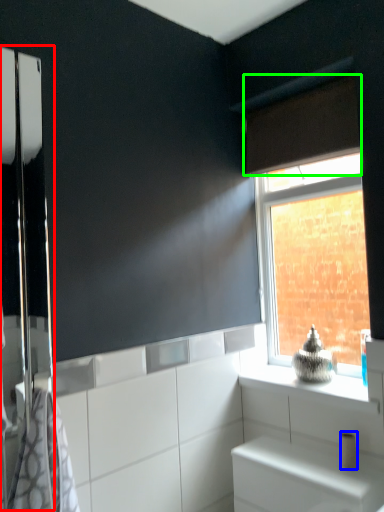
Question: Which object is positioned closest to screen door (highlighted by a red box)? Select from toilet paper (highlighted by a blue box) and curtain (highlighted by a green box).

Choices:
 (A) toilet paper
 (B) curtain

Answer: (B)